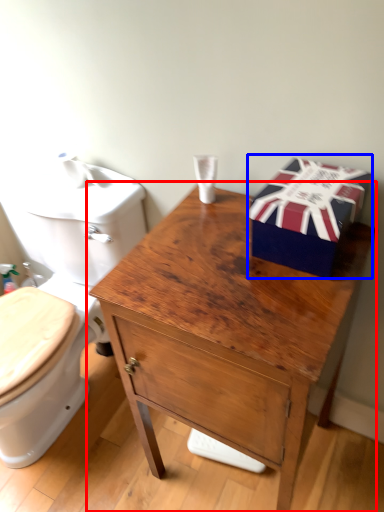
Question: Among these objects, which one is farthest to the camera, table (highlighted by a red box) or gift box (highlighted by a blue box)?

Choices:
 (A) table
 (B) gift box

Answer: (B)